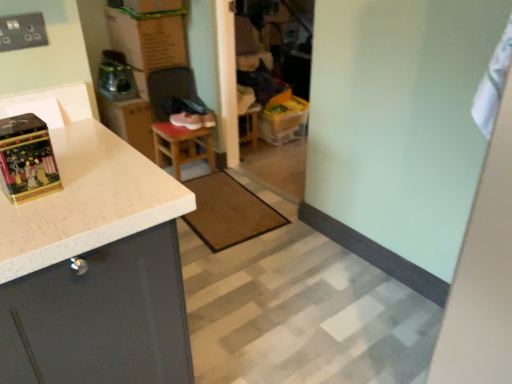
Identify the location of free space above brown textured mat at center (from a real-world perspective). (229, 205).